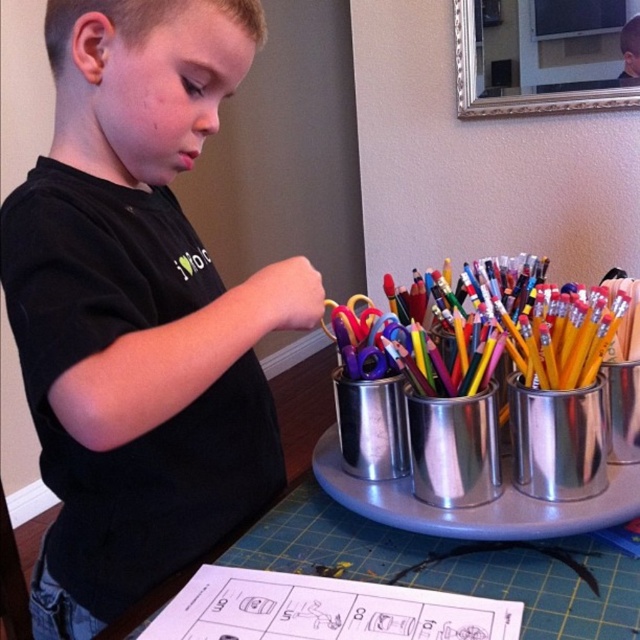
The boy is wearing a black matte shirt at center and has metallic silver canisters at center on the table. Which item takes up more space on the table?

The black matte shirt at center is larger in size than the metallic silver canisters at center, so the black matte shirt at center takes up more space on the table.

You are looking at the table where the boy is working. There are two points marked on the paper in front of him, labeled as point [211,68] and point [413,429]. Which of these points is closer to you?

Point [211,68] is closer to the viewer than point [413,429].

You are designing a layout for a digital interface and need to place an icon representing the boy in the scene. The interface has a coordinate system where the bottom left corner is the origin. Given the black matte shirt at center is at position point, which quadrant would the boy be in?

The black matte shirt at center is located at point coordinates. In a coordinate system with the origin at the bottom left, the boy would be in the first quadrant since both x and y coordinates are positive.